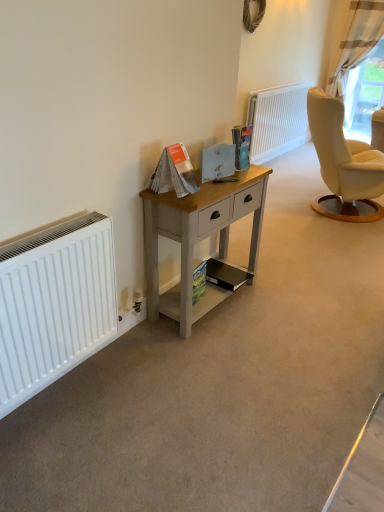
Locate an element on the screen. This screenshot has height=512, width=384. empty space that is in between light gray wood desk at center and matte black magazine at lower center, which ranks as the 2th magazine in bottom-to-top order is located at coordinates (220, 315).